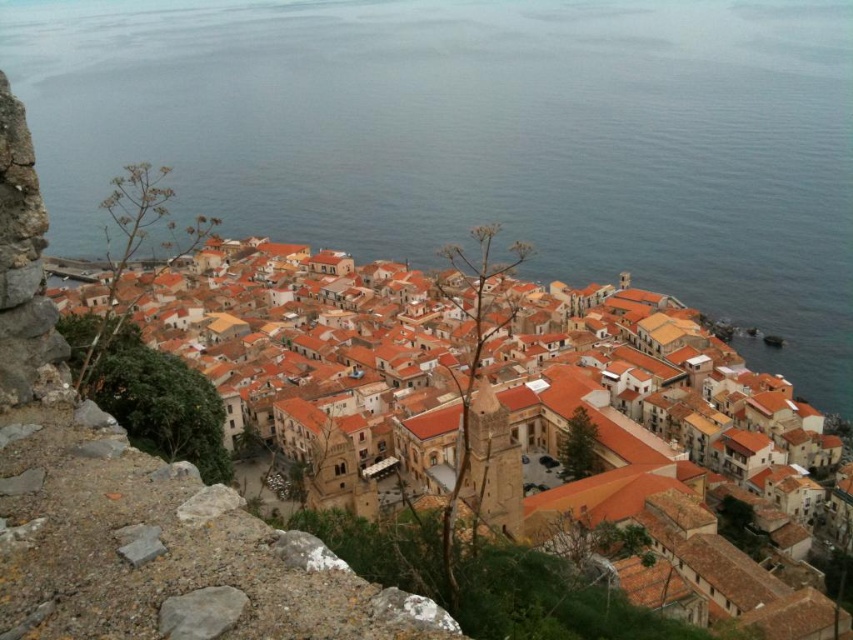
Question: Which of the following is the farthest from the observer?

Choices:
 (A) click(x=376, y=45)
 (B) click(x=514, y=445)

Answer: (A)

Question: Is the position of blue water at center more distant than that of orange clay buildings at center?

Choices:
 (A) yes
 (B) no

Answer: (A)

Question: Which point is farther from the camera taking this photo?

Choices:
 (A) (576, 500)
 (B) (741, 352)

Answer: (B)

Question: Is the position of blue water at center less distant than that of orange clay buildings at center?

Choices:
 (A) no
 (B) yes

Answer: (A)

Question: Is blue water at center closer to camera compared to orange clay buildings at center?

Choices:
 (A) yes
 (B) no

Answer: (B)